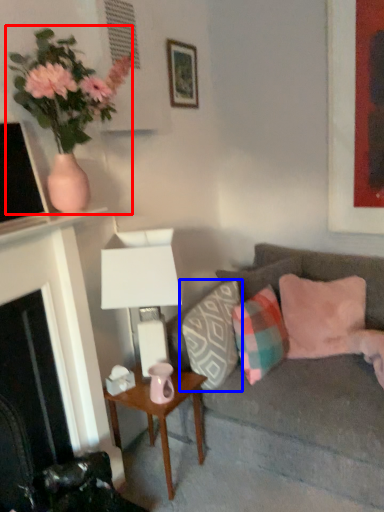
Question: Which of the following is the closest to the observer, houseplant (highlighted by a red box) or pillow (highlighted by a blue box)?

Choices:
 (A) houseplant
 (B) pillow

Answer: (A)